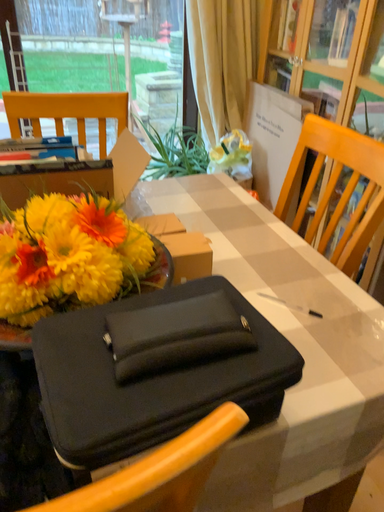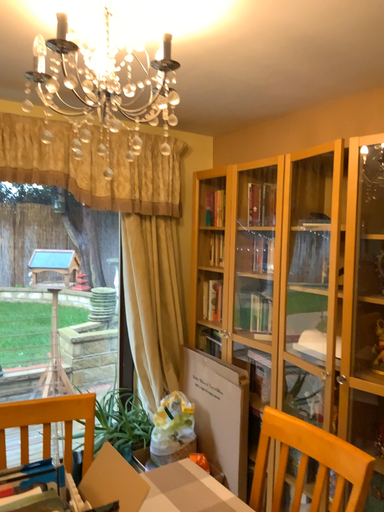
Question: How did the camera likely rotate when shooting the video?

Choices:
 (A) rotated right
 (B) rotated left

Answer: (A)